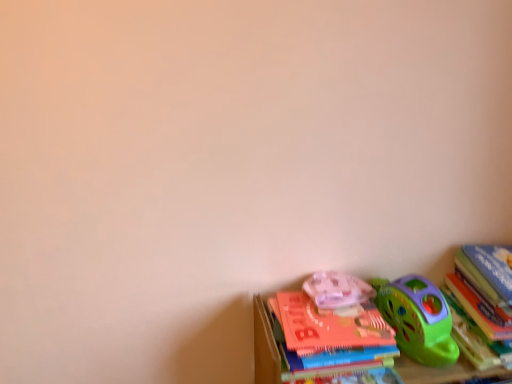
Where is `translucent plastic toy at lower right`? Image resolution: width=512 pixels, height=384 pixels. translucent plastic toy at lower right is located at coordinates [337, 290].

Image resolution: width=512 pixels, height=384 pixels. Describe the element at coordinates (337, 290) in the screenshot. I see `translucent plastic toy at lower right` at that location.

The image size is (512, 384). Describe the element at coordinates (482, 302) in the screenshot. I see `hardcover book at right` at that location.

In the scene shown: In order to face hardcover book at right, should I rotate leftwards or rightwards?

It's best to rotate right around 31.106 degrees.

I want to click on hardcover book at right, so click(x=482, y=302).

In order to click on translucent plastic toy at lower right in this screenshot , I will do `click(337, 290)`.

Considering the positions of objects translucent plastic toy at lower right and hardcover book at right in the image provided, who is more to the left, translucent plastic toy at lower right or hardcover book at right?

translucent plastic toy at lower right.

Is the depth of translucent plastic toy at lower right less than that of hardcover book at right?

No, translucent plastic toy at lower right is further to the viewer.

Which is closer to the camera, (361, 281) or (461, 345)?

Point (361, 281) appears to be farther away from the viewer than point (461, 345).

From the image's perspective, does translucent plastic toy at lower right appear higher than hardcover book at right?

Yes, from the image's perspective, translucent plastic toy at lower right is on top of hardcover book at right.

From a real-world perspective, is translucent plastic toy at lower right positioned over hardcover book at right based on gravity?

Correct, in the physical world, translucent plastic toy at lower right is higher than hardcover book at right.

Does translucent plastic toy at lower right have a greater width compared to hardcover book at right?

In fact, translucent plastic toy at lower right might be narrower than hardcover book at right.

Can you confirm if translucent plastic toy at lower right is taller than hardcover book at right?

Incorrect, the height of translucent plastic toy at lower right is not larger of that of hardcover book at right.

Does translucent plastic toy at lower right have a larger size compared to hardcover book at right?

Actually, translucent plastic toy at lower right might be smaller than hardcover book at right.

Would you say translucent plastic toy at lower right is inside or outside hardcover book at right?

translucent plastic toy at lower right is located beyond the bounds of hardcover book at right.

Are translucent plastic toy at lower right and hardcover book at right making contact?

No, translucent plastic toy at lower right is not making contact with hardcover book at right.

Is translucent plastic toy at lower right facing towards hardcover book at right?

No, translucent plastic toy at lower right is not aimed at hardcover book at right.

How far apart are translucent plastic toy at lower right and hardcover book at right?

12.40 inches.

This screenshot has height=384, width=512. I want to click on book in front of the translucent plastic toy at lower right, so point(482,302).

Can you confirm if hardcover book at right is positioned to the right of translucent plastic toy at lower right?

Yes, hardcover book at right is to the right of translucent plastic toy at lower right.

In the image, is hardcover book at right positioned in front of or behind translucent plastic toy at lower right?

hardcover book at right is in front of translucent plastic toy at lower right.

Considering the positions of points (505, 302) and (335, 279), is point (505, 302) farther from camera compared to point (335, 279)?

No, (505, 302) is in front of (335, 279).

From the image's perspective, is hardcover book at right located above or below translucent plastic toy at lower right?

hardcover book at right is situated lower than translucent plastic toy at lower right in the image.

From a real-world perspective, relative to translucent plastic toy at lower right, is hardcover book at right vertically above or below?

hardcover book at right is below translucent plastic toy at lower right.

Is hardcover book at right wider than translucent plastic toy at lower right?

Indeed, hardcover book at right has a greater width compared to translucent plastic toy at lower right.

Is hardcover book at right taller than translucent plastic toy at lower right?

Indeed, hardcover book at right has a greater height compared to translucent plastic toy at lower right.

Considering the relative sizes of hardcover book at right and translucent plastic toy at lower right in the image provided, is hardcover book at right bigger than translucent plastic toy at lower right?

Indeed, hardcover book at right has a larger size compared to translucent plastic toy at lower right.

Is hardcover book at right inside the boundaries of translucent plastic toy at lower right, or outside?

hardcover book at right is spatially situated outside translucent plastic toy at lower right.

Is hardcover book at right directly adjacent to translucent plastic toy at lower right?

There is a gap between hardcover book at right and translucent plastic toy at lower right.

Is hardcover book at right looking in the opposite direction of translucent plastic toy at lower right?

That's not correct — hardcover book at right is not looking away from translucent plastic toy at lower right.

What are the coordinates of `toy located above the hardcover book at right (from a real-world perspective)` in the screenshot? It's located at (337, 290).

Find the location of a particular element. This screenshot has width=512, height=384. toy located above the hardcover book at right (from a real-world perspective) is located at coordinates (337, 290).

Where is `toy located on the left of hardcover book at right`? The height and width of the screenshot is (384, 512). toy located on the left of hardcover book at right is located at coordinates (337, 290).